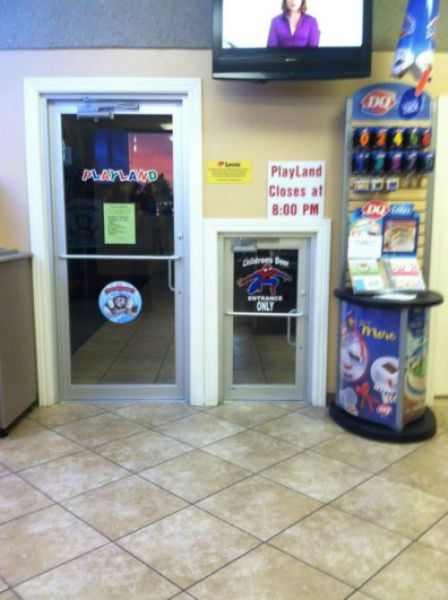
Where is `door lock`? door lock is located at coordinates (180, 236), (303, 292).